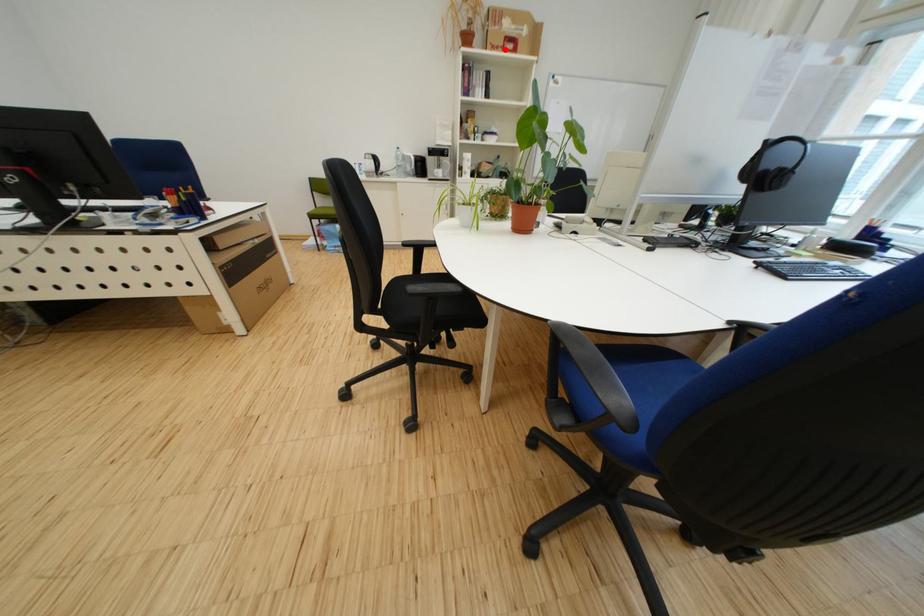
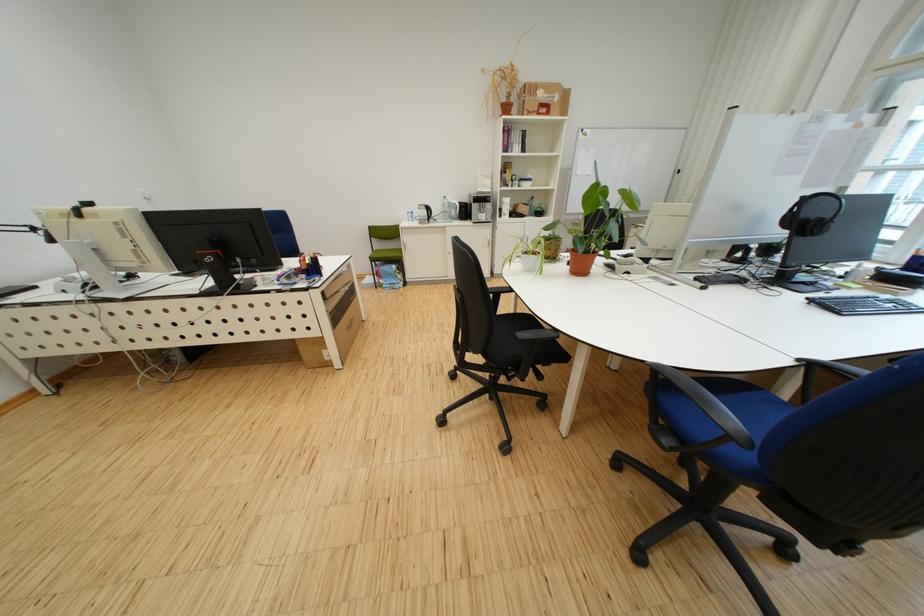
In the second image, find the point that corresponds to the highlighted location in the first image.

(541, 115)